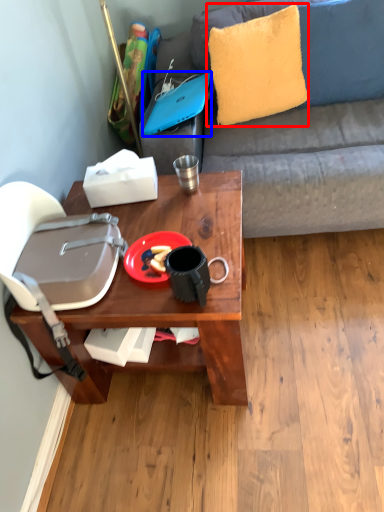
Question: Which of the following is the closest to the observer, pillow (highlighted by a red box) or laptop (highlighted by a blue box)?

Choices:
 (A) pillow
 (B) laptop

Answer: (B)